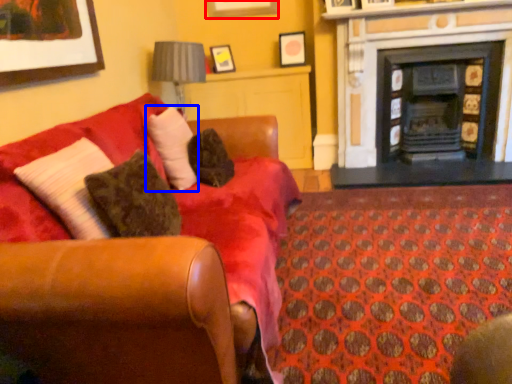
Question: Which object appears closest to the camera in this image, picture frame (highlighted by a red box) or pillow (highlighted by a blue box)?

Choices:
 (A) picture frame
 (B) pillow

Answer: (B)